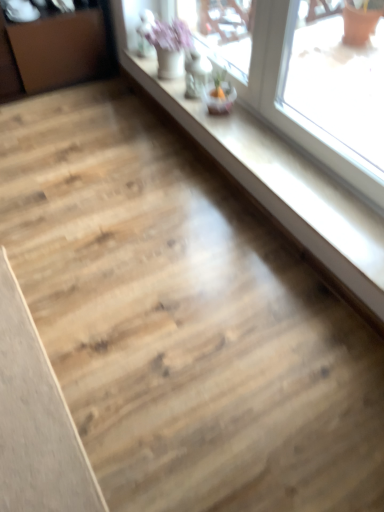
Image resolution: width=384 pixels, height=512 pixels. What do you see at coordinates (272, 174) in the screenshot?
I see `transparent glass window at upper right` at bounding box center [272, 174].

Find the location of a particular element. This screenshot has width=384, height=512. light brown wood plank at lower left is located at coordinates (36, 419).

Is light brown wood plank at lower left turned away from brown wood dresser at left?

light brown wood plank at lower left does not have its back to brown wood dresser at left.

From a real-world perspective, relative to brown wood dresser at left, is light brown wood plank at lower left vertically above or below?

Clearly, from a real-world perspective, light brown wood plank at lower left is below brown wood dresser at left.

Consider the image. Is light brown wood plank at lower left outside of brown wood dresser at left?

light brown wood plank at lower left lies outside brown wood dresser at left's area.

Based on their sizes in the image, would you say transparent glass window at upper right is bigger or smaller than light brown wood plank at lower left?

Clearly, transparent glass window at upper right is larger in size than light brown wood plank at lower left.

Find the location of a particular element. The image size is (384, 512). window above the light brown wood plank at lower left (from the image's perspective) is located at coordinates (272, 174).

From the image's perspective, would you say transparent glass window at upper right is shown under light brown wood plank at lower left?

No.

Does brown wood dresser at left have a greater width compared to light brown wood plank at lower left?

Incorrect, the width of brown wood dresser at left does not surpass that of light brown wood plank at lower left.

Can you tell me how much brown wood dresser at left and light brown wood plank at lower left differ in facing direction?

They differ by 0.154 degrees in their facing directions.

Is brown wood dresser at left outside of light brown wood plank at lower left?

Indeed, brown wood dresser at left is completely outside light brown wood plank at lower left.

Is brown wood dresser at left oriented towards light brown wood plank at lower left?

Yes, brown wood dresser at left is aimed at light brown wood plank at lower left.

From a real-world perspective, which is physically below, transparent glass window at upper right or brown wood dresser at left?

From a 3D spatial view, transparent glass window at upper right is below.

Is transparent glass window at upper right bigger than brown wood dresser at left?

No, transparent glass window at upper right is not bigger than brown wood dresser at left.

Find the location of a particular element. dresser located above the transparent glass window at upper right (from the image's perspective) is located at coordinates (55, 52).

From the image's perspective, is brown wood dresser at left located above or below transparent glass window at upper right?

brown wood dresser at left is situated higher than transparent glass window at upper right in the image.

How many degrees apart are the facing directions of brown wood dresser at left and transparent glass window at upper right?

90 degrees separate the facing orientations of brown wood dresser at left and transparent glass window at upper right.

Between brown wood dresser at left and transparent glass window at upper right, which one appears on the right side from the viewer's perspective?

transparent glass window at upper right is more to the right.

Considering the relative sizes of brown wood dresser at left and transparent glass window at upper right in the image provided, is brown wood dresser at left wider than transparent glass window at upper right?

Correct, the width of brown wood dresser at left exceeds that of transparent glass window at upper right.

Identify the location of plank lying below the transparent glass window at upper right (from the image's perspective). (36, 419).

From the image's perspective, is light brown wood plank at lower left above transparent glass window at upper right?

No, from the image's perspective, light brown wood plank at lower left is not over transparent glass window at upper right.

Is light brown wood plank at lower left in front of or behind transparent glass window at upper right in the image?

Clearly, light brown wood plank at lower left is in front of transparent glass window at upper right.

Considering the positions of objects light brown wood plank at lower left and transparent glass window at upper right in the image provided, who is more to the left, light brown wood plank at lower left or transparent glass window at upper right?

From the viewer's perspective, light brown wood plank at lower left appears more on the left side.

Identify the location of dresser located behind the light brown wood plank at lower left. Image resolution: width=384 pixels, height=512 pixels. (55, 52).

In the image, there is a transparent glass window at upper right. Identify the location of plank below it (from the image's perspective). The image size is (384, 512). pyautogui.click(x=36, y=419).

When comparing their distances from transparent glass window at upper right, does brown wood dresser at left or light brown wood plank at lower left seem closer?

The object closer to transparent glass window at upper right is brown wood dresser at left.

From the image, which object appears to be farther from light brown wood plank at lower left, brown wood dresser at left or transparent glass window at upper right?

brown wood dresser at left is further to light brown wood plank at lower left.

Which object lies nearer to the anchor point light brown wood plank at lower left, transparent glass window at upper right or brown wood dresser at left?

transparent glass window at upper right lies closer to light brown wood plank at lower left than the other object.

From the image, which object appears to be farther from brown wood dresser at left, transparent glass window at upper right or light brown wood plank at lower left?

light brown wood plank at lower left is positioned further to the anchor brown wood dresser at left.

From the image, which object appears to be nearer to transparent glass window at upper right, light brown wood plank at lower left or brown wood dresser at left?

brown wood dresser at left lies closer to transparent glass window at upper right than the other object.

When comparing their distances from brown wood dresser at left, does light brown wood plank at lower left or transparent glass window at upper right seem closer?

transparent glass window at upper right is closer to brown wood dresser at left.

Find the location of a particular element. window between brown wood dresser at left and light brown wood plank at lower left from top to bottom is located at coordinates (272, 174).